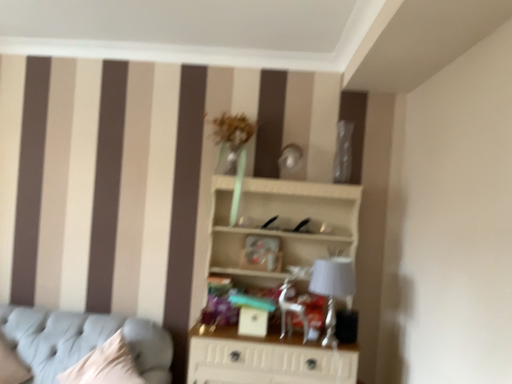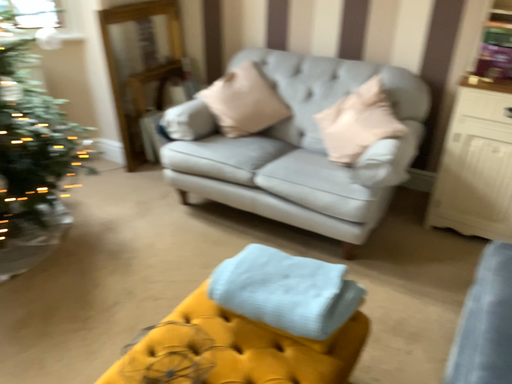
Question: Which way did the camera rotate in the video?

Choices:
 (A) rotated right
 (B) rotated left

Answer: (B)